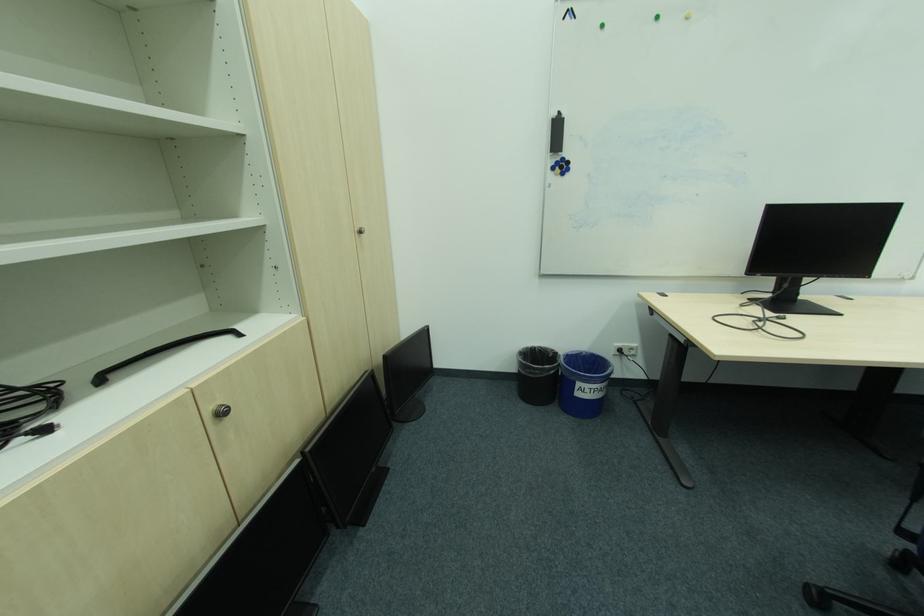
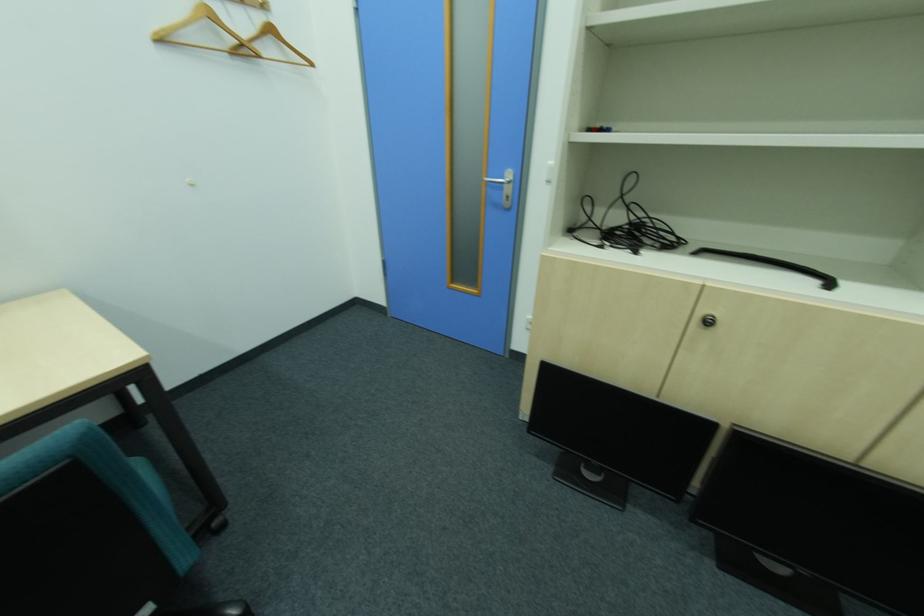
Based on the continuous images, in which direction is the camera rotating?

The rotation direction of the camera is left-down.